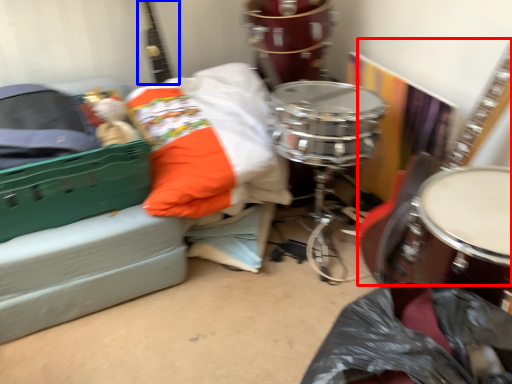
Question: Which object is closer to the camera taking this photo, guitar (highlighted by a red box) or guitar (highlighted by a blue box)?

Choices:
 (A) guitar
 (B) guitar

Answer: (A)